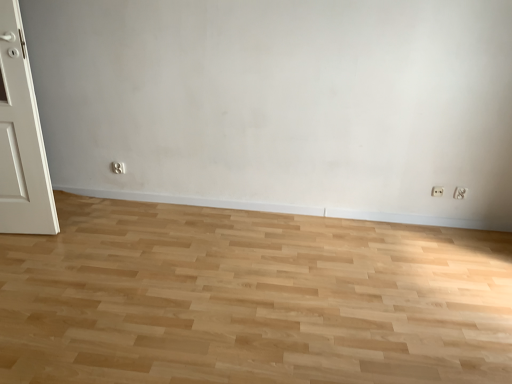
Question: Are white plastic electric outlet at lower right, positioned as the first electric outlet in right-to-left order, and natural wood floor at center far apart?

Choices:
 (A) yes
 (B) no

Answer: (A)

Question: From a real-world perspective, is white plastic electric outlet at lower right, which ranks as the second electric outlet in left-to-right order, located higher than natural wood floor at center?

Choices:
 (A) no
 (B) yes

Answer: (B)

Question: Is white plastic electric outlet at lower right, positioned as the first electric outlet in right-to-left order, at the left side of natural wood floor at center?

Choices:
 (A) no
 (B) yes

Answer: (A)

Question: Considering the relative positions of white plastic electric outlet at lower right, positioned as the first electric outlet in right-to-left order, and natural wood floor at center in the image provided, is white plastic electric outlet at lower right, positioned as the first electric outlet in right-to-left order, to the right of natural wood floor at center from the viewer's perspective?

Choices:
 (A) yes
 (B) no

Answer: (A)

Question: Is white plastic electric outlet at lower right, which ranks as the second electric outlet in left-to-right order, further to camera compared to natural wood floor at center?

Choices:
 (A) no
 (B) yes

Answer: (B)

Question: Can you confirm if white plastic electric outlet at lower right, which ranks as the second electric outlet in left-to-right order, is taller than natural wood floor at center?

Choices:
 (A) yes
 (B) no

Answer: (A)

Question: Can you confirm if natural wood floor at center is positioned to the right of white plastic electric outlet at lower right, positioned as the first electric outlet in right-to-left order?

Choices:
 (A) yes
 (B) no

Answer: (B)

Question: Can you confirm if natural wood floor at center is thinner than white plastic electric outlet at lower right, which ranks as the second electric outlet in left-to-right order?

Choices:
 (A) no
 (B) yes

Answer: (A)

Question: Is natural wood floor at center behind white plastic electric outlet at lower right, which ranks as the second electric outlet in left-to-right order?

Choices:
 (A) no
 (B) yes

Answer: (A)

Question: Is natural wood floor at center shorter than white plastic electric outlet at lower right, positioned as the first electric outlet in right-to-left order?

Choices:
 (A) yes
 (B) no

Answer: (A)

Question: Is natural wood floor at center bigger than white plastic electric outlet at lower right, positioned as the first electric outlet in right-to-left order?

Choices:
 (A) no
 (B) yes

Answer: (B)

Question: Can you confirm if natural wood floor at center is positioned to the left of white plastic electric outlet at lower right, positioned as the first electric outlet in right-to-left order?

Choices:
 (A) yes
 (B) no

Answer: (A)

Question: From a real-world perspective, is white plastic electric outlet at lower right, acting as the first electric outlet starting from the left, on top of natural wood floor at center?

Choices:
 (A) no
 (B) yes

Answer: (B)